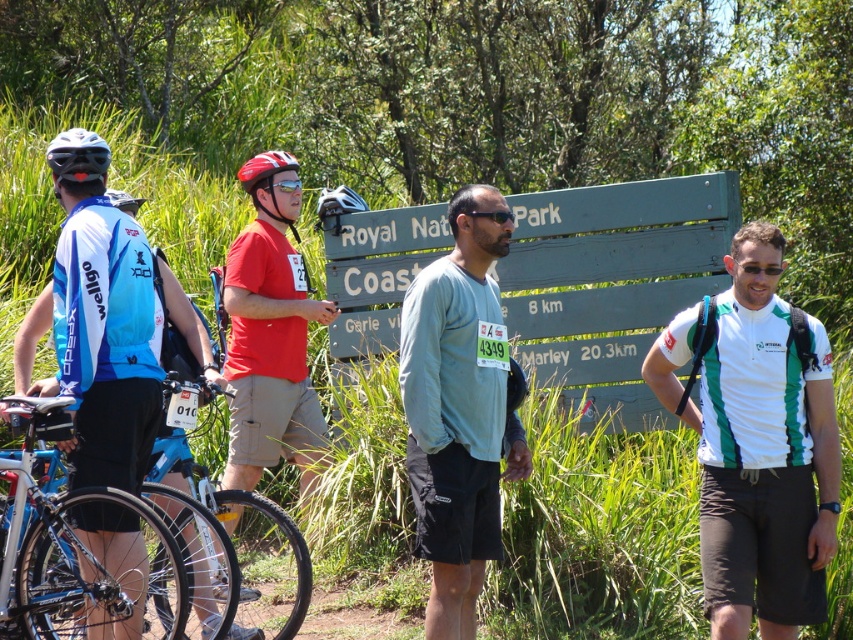
Can you confirm if green wooden sign at center is positioned to the left of clear plastic goggles at center?

No, green wooden sign at center is not to the left of clear plastic goggles at center.

Can you confirm if green wooden sign at center is positioned to the right of clear plastic goggles at center?

Correct, you'll find green wooden sign at center to the right of clear plastic goggles at center.

Locate an element on the screen. The height and width of the screenshot is (640, 853). green wooden sign at center is located at coordinates (611, 282).

Can you confirm if white/green striped shirt at center is positioned to the left of black matte bicycle helmet at left?

In fact, white/green striped shirt at center is to the right of black matte bicycle helmet at left.

Is point (689, 323) positioned behind point (54, 140)?

That is True.

Locate an element on the screen. The height and width of the screenshot is (640, 853). white/green striped shirt at center is located at coordinates (757, 442).

Locate an element on the screen. The height and width of the screenshot is (640, 853). white/green striped shirt at center is located at coordinates (757, 442).

Which is more to the right, black matte bicycle helmet at left or black matte sunglasses at center?

black matte sunglasses at center is more to the right.

You are a GUI agent. You are given a task and a screenshot of the screen. Output one action in this format:
    pyautogui.click(x=<x>, y=<y>)
    Task: Click on the black matte bicycle helmet at left
    This screenshot has width=853, height=640.
    Given the screenshot: What is the action you would take?
    pyautogui.click(x=78, y=156)